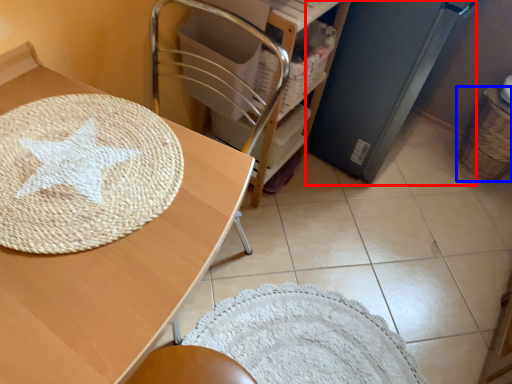
Question: Which point is closer to the camera, appliance (highlighted by a red box) or basket (highlighted by a blue box)?

Choices:
 (A) appliance
 (B) basket

Answer: (A)